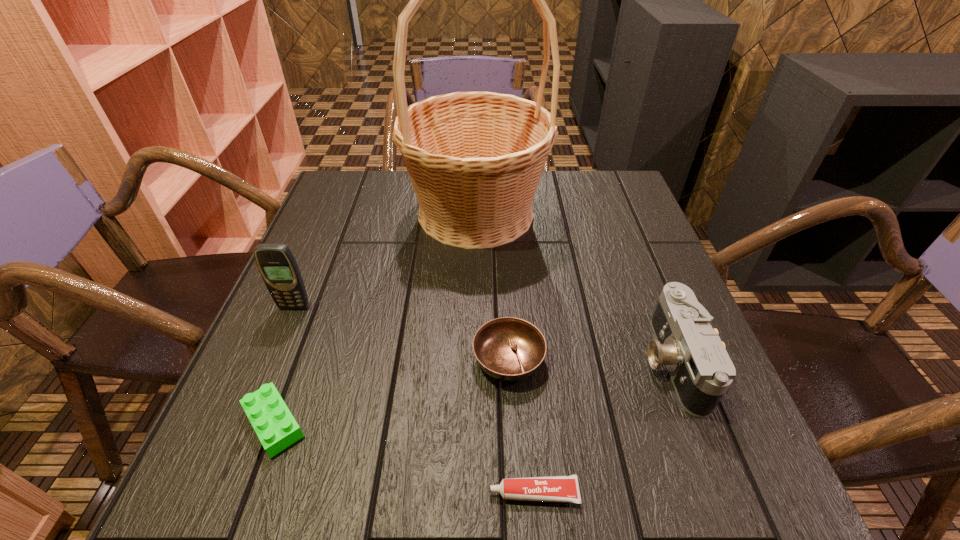
Locate which object ranks fourth in proximity to the camera. Please provide its 2D coordinates. Your answer should be formatted as a tuple, i.e. [(x, y)], where the tuple contains the x and y coordinates of a point satisfying the conditions above.

[(275, 426)]

Locate an element on the screen. The image size is (960, 540). object that ranks as the fourth closest to the shortest object is located at coordinates (277, 265).